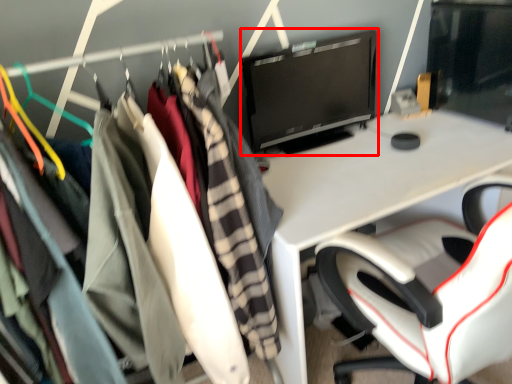
Question: Where is computer monitor (annotated by the red box) located in relation to clothing in the image?

Choices:
 (A) left
 (B) right

Answer: (B)